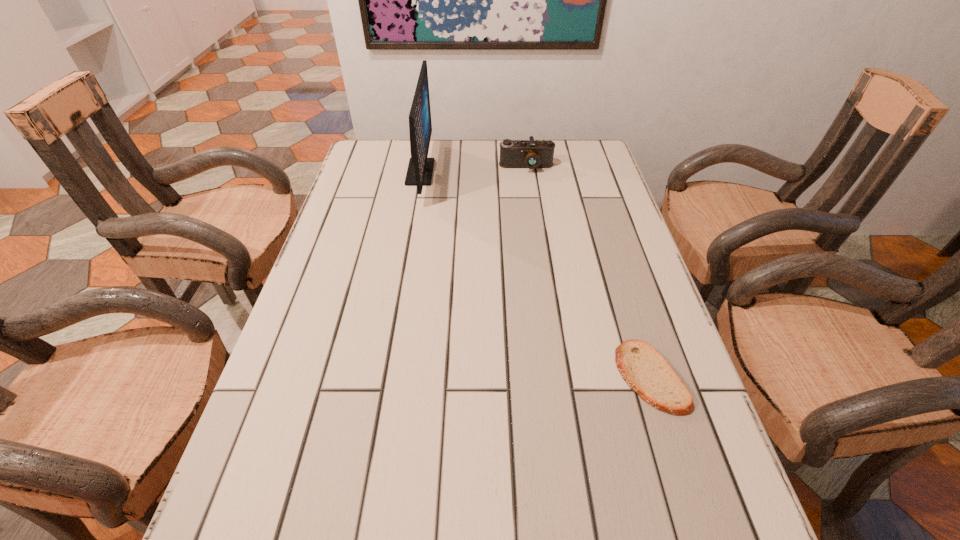
Locate an element on the screen. The image size is (960, 540). free space that satisfies the following two spatial constraints: 1. on the lens of the camera; 2. on the screen side of the computer monitor is located at coordinates (527, 172).

You are a GUI agent. You are given a task and a screenshot of the screen. Output one action in this format:
    pyautogui.click(x=<x>, y=<y>)
    Task: Click on the vacant region that satisfies the following two spatial constraints: 1. on the screen side of the pita bread; 2. on the right side of the tallest object
    
    Given the screenshot: What is the action you would take?
    pyautogui.click(x=384, y=377)

Find the location of a particular element. free spot that satisfies the following two spatial constraints: 1. on the lens of the camera; 2. on the screen side of the computer monitor is located at coordinates (527, 172).